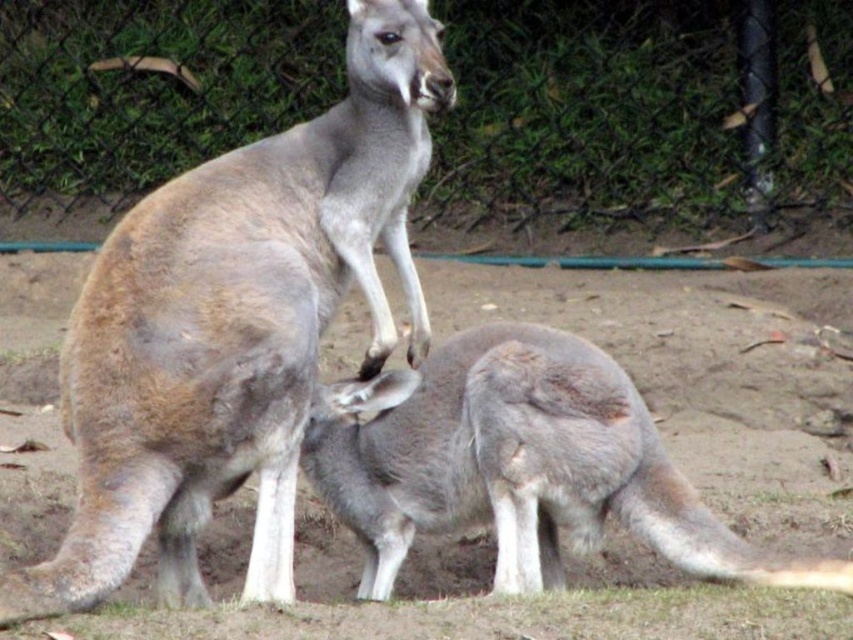
Question: Can you confirm if gray fur kangaroo at center is positioned to the right of gray fur kangaroo at lower center?

Choices:
 (A) yes
 (B) no

Answer: (B)

Question: Is gray fur kangaroo at center positioned before gray fur kangaroo at lower center?

Choices:
 (A) yes
 (B) no

Answer: (A)

Question: Which point is closer to the camera taking this photo?

Choices:
 (A) (198, 364)
 (B) (543, 352)

Answer: (A)

Question: Which object appears closest to the camera in this image?

Choices:
 (A) gray fur kangaroo at center
 (B) gray fur kangaroo at lower center

Answer: (A)

Question: Does gray fur kangaroo at center have a greater width compared to gray fur kangaroo at lower center?

Choices:
 (A) yes
 (B) no

Answer: (B)